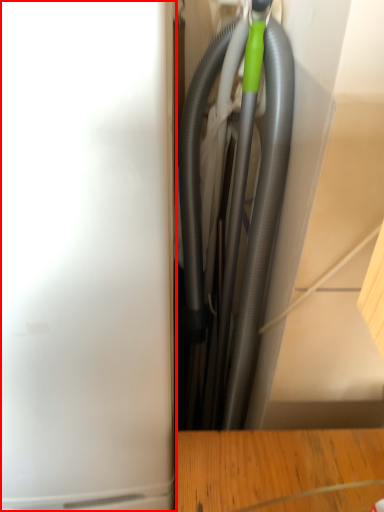
Question: Where is appliance (annotated by the red box) located in relation to garden hose in the image?

Choices:
 (A) right
 (B) left

Answer: (B)